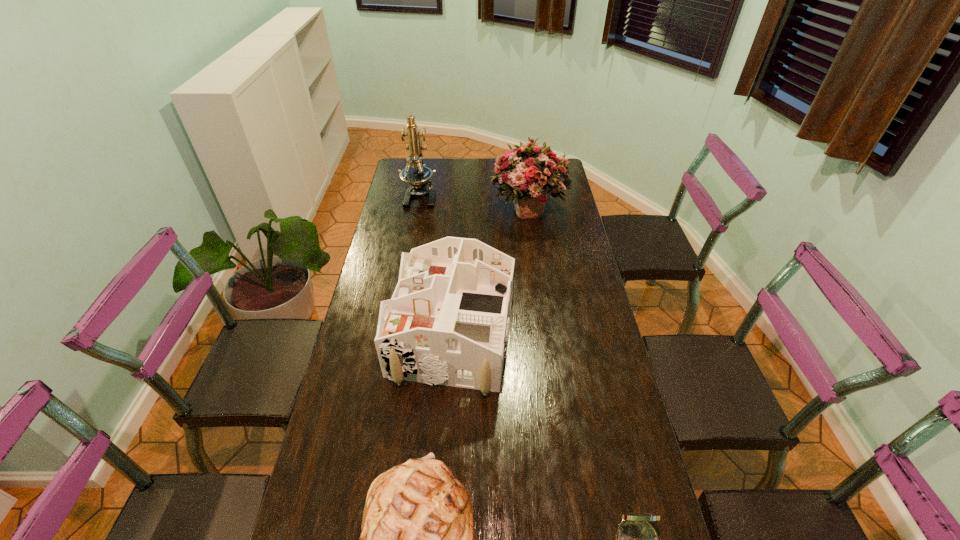
Identify the location of microscope. (419, 176).

Find the location of a particular element. The height and width of the screenshot is (540, 960). the second tallest object is located at coordinates (527, 173).

Where is `the third nearest object`? The width and height of the screenshot is (960, 540). the third nearest object is located at coordinates (447, 323).

Find the location of a particular element. the third shortest object is located at coordinates (447, 323).

Identify the location of free space located at the eyepiece of the tallest object. (412, 244).

I want to click on free region located 0.140m on the back of the bouquet, so tap(522, 171).

Find the location of a particular element. The image size is (960, 540). free space located 0.170m on the back of the dollhouse is located at coordinates (458, 256).

Identify the location of object that is at the far edge. The height and width of the screenshot is (540, 960). (419, 176).

Image resolution: width=960 pixels, height=540 pixels. I want to click on microscope that is positioned at the left edge, so click(x=419, y=176).

Identify the location of dollhouse located at the left edge. (447, 323).